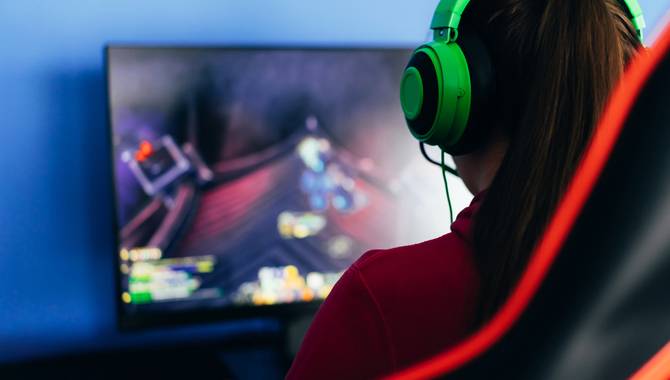
The image size is (670, 380). I want to click on lcd screen, so click(x=218, y=84).